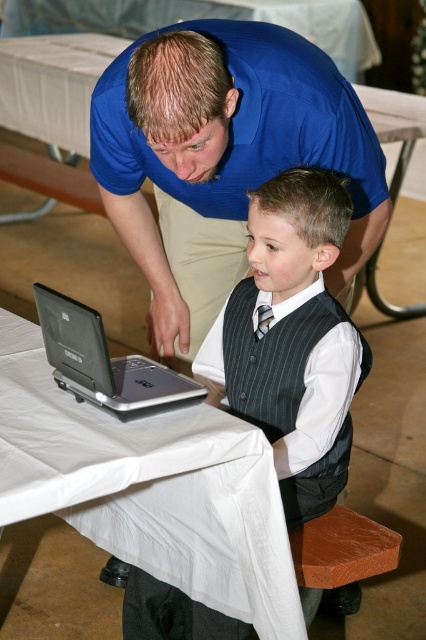
Is blue smooth shirt at upper center shorter than black pinstripe tie at center?

No.

Which is in front, point (226, 141) or point (261, 317)?

Positioned in front is point (226, 141).

Where is `blue smooth shirt at upper center`? Image resolution: width=426 pixels, height=640 pixels. blue smooth shirt at upper center is located at coordinates (224, 152).

Locate an element on the screen. blue smooth shirt at upper center is located at coordinates (224, 152).

Who is shorter, blue smooth shirt at upper center or silver metallic laptop at center?

With less height is silver metallic laptop at center.

Where is `blue smooth shirt at upper center`? blue smooth shirt at upper center is located at coordinates (224, 152).

Describe the element at coordinates (224, 152) in the screenshot. I see `blue smooth shirt at upper center` at that location.

I want to click on blue smooth shirt at upper center, so click(x=224, y=152).

Which is below, pinstriped vest at center or black pinstripe tie at center?

pinstriped vest at center is lower down.

Does pinstriped vest at center appear under black pinstripe tie at center?

Indeed, pinstriped vest at center is positioned under black pinstripe tie at center.

Describe the element at coordinates (291, 339) in the screenshot. I see `pinstriped vest at center` at that location.

Where is `pinstriped vest at center`? The width and height of the screenshot is (426, 640). pinstriped vest at center is located at coordinates (291, 339).